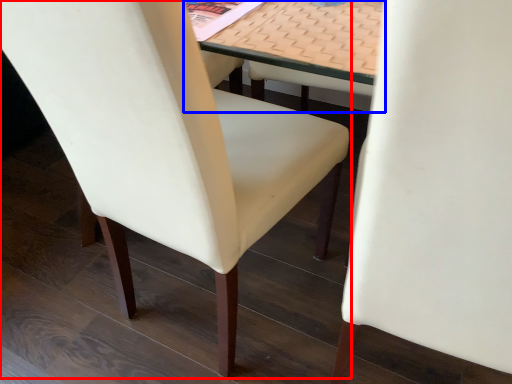
Question: Which object appears closest to the camera in this image, chair (highlighted by a red box) or table (highlighted by a blue box)?

Choices:
 (A) chair
 (B) table

Answer: (A)